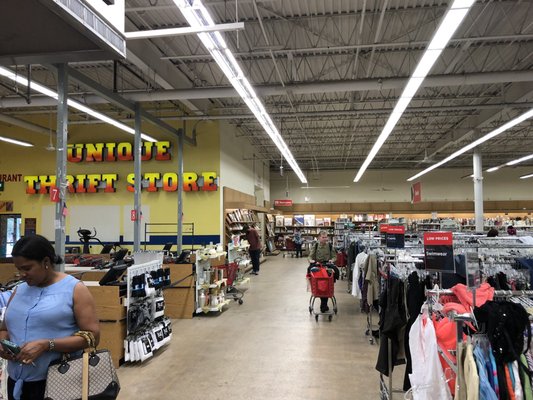
You are a GUI agent. You are given a task and a screenshot of the screen. Output one action in this format:
    pyautogui.click(x=<x>, y=<y>)
    Task: Click on the door
    This screenshot has width=533, height=400.
    Given the screenshot: What is the action you would take?
    pyautogui.click(x=11, y=234)